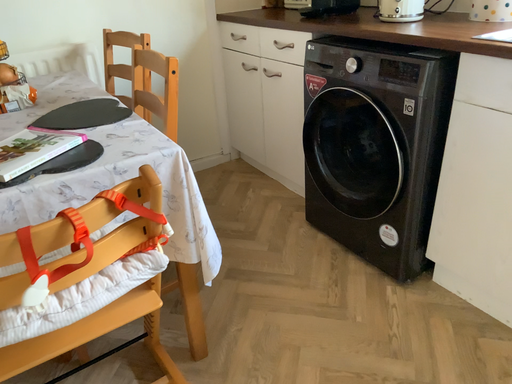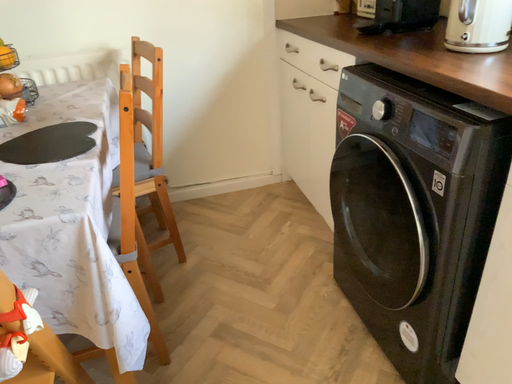
Question: How did the camera likely rotate when shooting the video?

Choices:
 (A) rotated right
 (B) rotated left

Answer: (B)